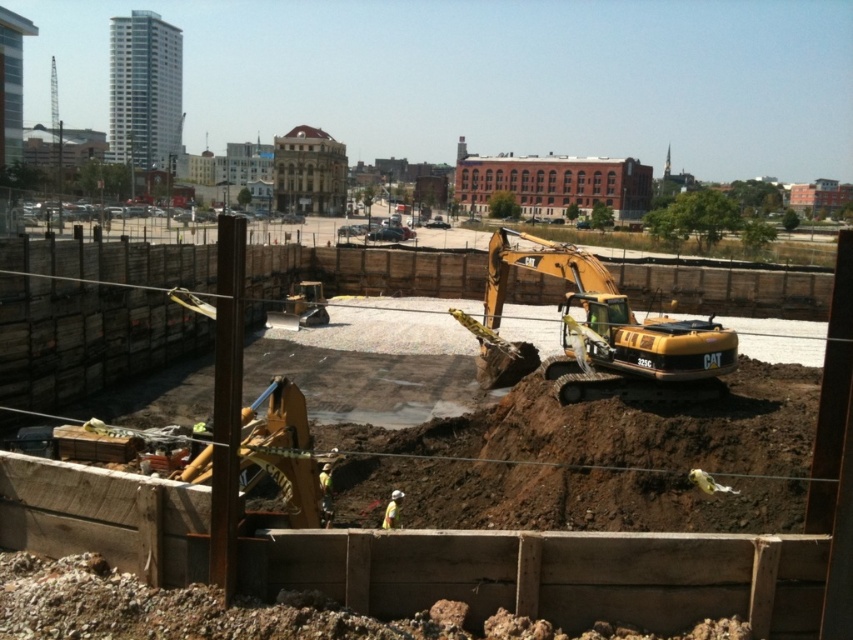
Does point (718, 561) lie in front of point (621, 385)?

Yes, point (718, 561) is closer to viewer.

Identify the location of yellow excavator at center. (598, 552).

Does brown/dry soil at lower center have a lesser height compared to yellow metallic excavator at center?

Indeed, brown/dry soil at lower center has a lesser height compared to yellow metallic excavator at center.

Between point (350, 627) and point (538, 256), which one is positioned in front?

Point (350, 627) is in front.

Does point (74, 614) come in front of point (637, 371)?

Yes, point (74, 614) is in front of point (637, 371).

The height and width of the screenshot is (640, 853). Identify the location of brown/dry soil at lower center. (242, 611).

Does yellow excavator at center appear on the right side of brown/dry soil at lower center?

No, yellow excavator at center is not to the right of brown/dry soil at lower center.

What do you see at coordinates (598, 552) in the screenshot?
I see `yellow excavator at center` at bounding box center [598, 552].

Locate an element on the screen. yellow excavator at center is located at coordinates (598, 552).